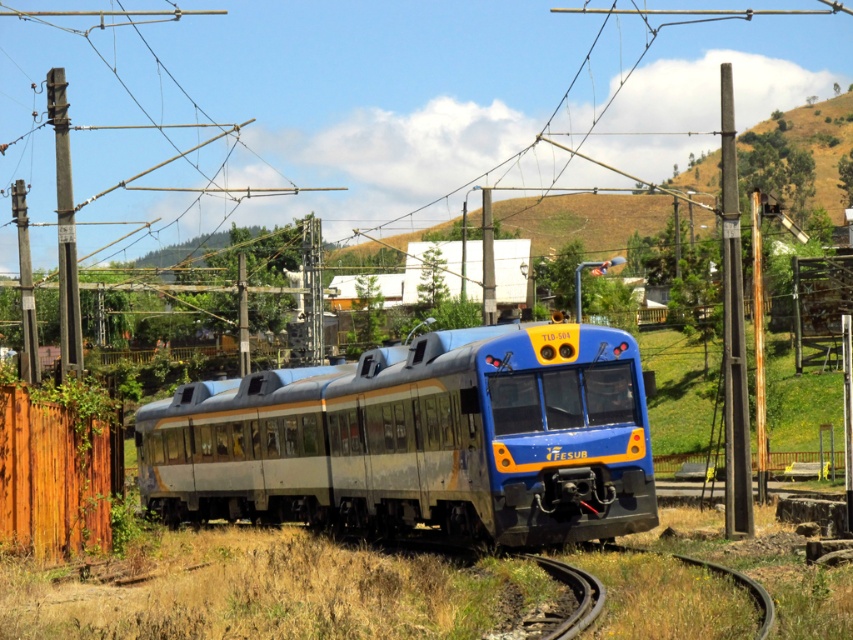
Question: Which point is closer to the camera?

Choices:
 (A) (73, 532)
 (B) (730, 534)

Answer: (A)

Question: Does blue metallic train at center appear on the left side of metallic gray pole at left?

Choices:
 (A) no
 (B) yes

Answer: (A)

Question: Among these objects, which one is farthest from the camera?

Choices:
 (A) smooth gray pole at right
 (B) metallic gray pole at left
 (C) blue metallic train at center

Answer: (B)

Question: Estimate the real-world distances between objects in this image. Which object is closer to the smooth gray pole at right?

Choices:
 (A) metallic gray pole at left
 (B) blue metallic train at center

Answer: (B)

Question: Does smooth gray pole at right have a smaller size compared to metallic gray pole at left?

Choices:
 (A) yes
 (B) no

Answer: (A)

Question: Observing the image, what is the correct spatial positioning of brown wooden fence at lower left in reference to metallic gray pole at left?

Choices:
 (A) below
 (B) above

Answer: (A)